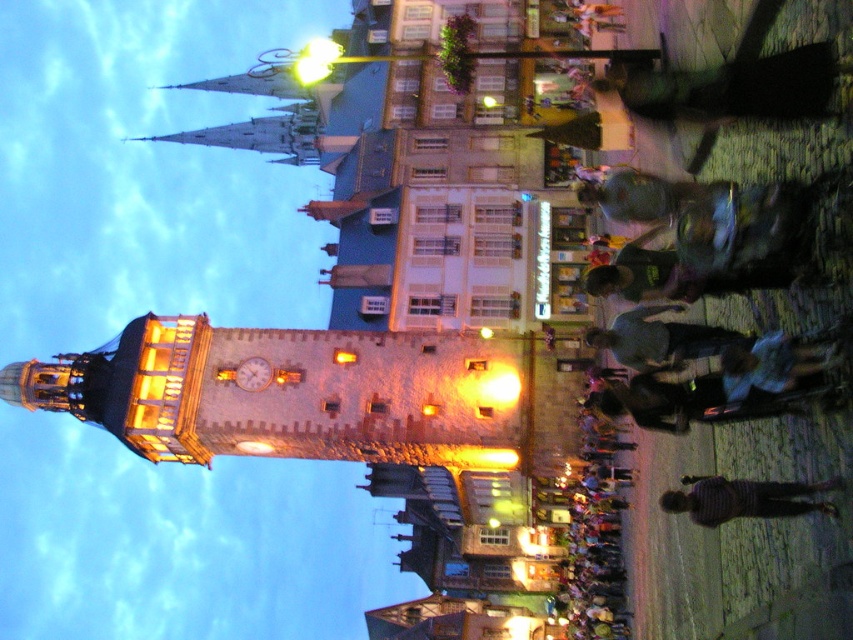
You are standing in the town square and want to hand a flyer to a person wearing a dark gray shirt at center. You have a flyer in your hand. Can you reach them without moving from your current position if you are 5 feet away from the dark gray fabric jacket at lower right?

The dark gray fabric jacket at lower right is 8.72 feet from the dark gray shirt at center. Since you are 5 feet away from the dark gray fabric jacket at lower right, you are approximately 13.72 feet away from the dark gray shirt at center. Therefore, you cannot reach them without moving.